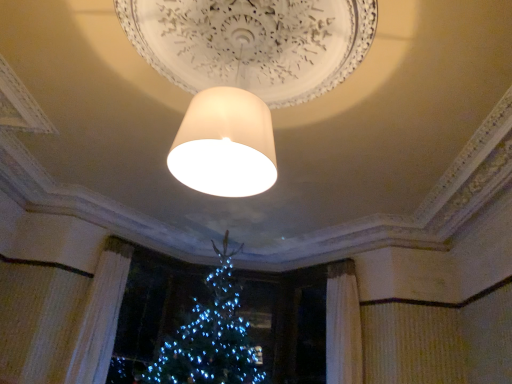
Question: Is matte white lampshade at center wider than white textured curtain at lower left?

Choices:
 (A) yes
 (B) no

Answer: (A)

Question: Is matte white lampshade at center completely or partially outside of white textured curtain at lower left?

Choices:
 (A) no
 (B) yes

Answer: (B)

Question: Does matte white lampshade at center touch white textured curtain at lower left?

Choices:
 (A) yes
 (B) no

Answer: (B)

Question: Can you confirm if matte white lampshade at center is shorter than white textured curtain at lower left?

Choices:
 (A) yes
 (B) no

Answer: (A)

Question: Is matte white lampshade at center at the left side of white textured curtain at lower left?

Choices:
 (A) yes
 (B) no

Answer: (B)

Question: Considering the relative sizes of matte white lampshade at center and white textured curtain at lower left in the image provided, is matte white lampshade at center smaller than white textured curtain at lower left?

Choices:
 (A) yes
 (B) no

Answer: (B)

Question: Can you confirm if white textured curtain at lower left is positioned to the left of matte white lampshade at center?

Choices:
 (A) yes
 (B) no

Answer: (A)

Question: Is white textured curtain at lower left positioned with its back to matte white lampshade at center?

Choices:
 (A) yes
 (B) no

Answer: (B)

Question: Is white textured curtain at lower left aimed at matte white lampshade at center?

Choices:
 (A) no
 (B) yes

Answer: (B)

Question: Does white textured curtain at lower left come in front of matte white lampshade at center?

Choices:
 (A) yes
 (B) no

Answer: (B)

Question: Does white textured curtain at lower left touch matte white lampshade at center?

Choices:
 (A) no
 (B) yes

Answer: (A)

Question: Can you confirm if white textured curtain at lower left is bigger than matte white lampshade at center?

Choices:
 (A) yes
 (B) no

Answer: (B)

Question: Visually, is white textured curtain at lower left positioned to the left or to the right of matte white lampshade at center?

Choices:
 (A) right
 (B) left

Answer: (B)